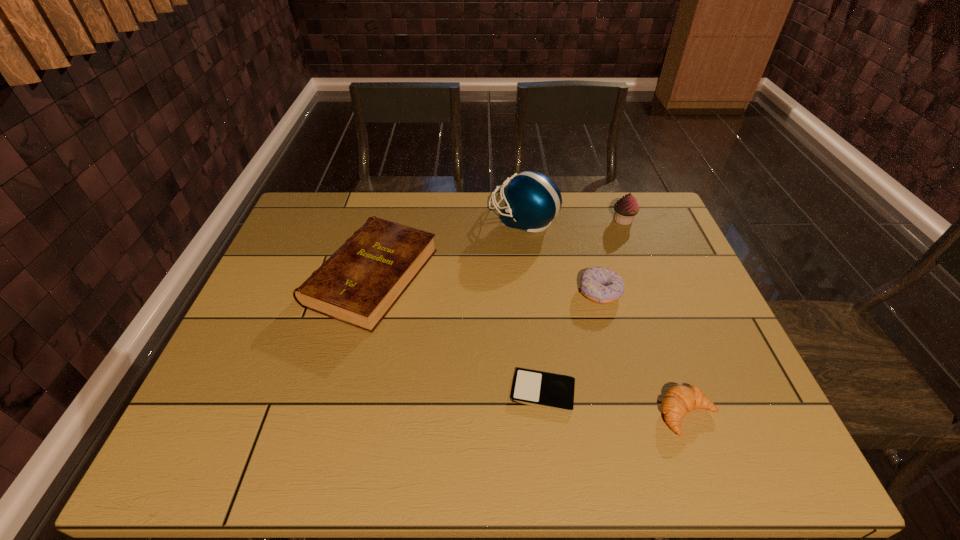
The width and height of the screenshot is (960, 540). I want to click on football helmet, so click(x=532, y=200).

I want to click on cupcake, so click(x=626, y=208).

This screenshot has height=540, width=960. I want to click on the leftmost object, so click(x=359, y=284).

I want to click on hardback book, so click(x=359, y=284).

Image resolution: width=960 pixels, height=540 pixels. Find the location of `doughnut`. doughnut is located at coordinates (602, 285).

At what (x,y) coordinates should I click in order to perform the action: click on crescent roll. Please return your answer as a coordinate pair (x, y). Looking at the image, I should click on (680, 399).

This screenshot has width=960, height=540. In order to click on iPod in this screenshot , I will do `click(547, 390)`.

You are a GUI agent. You are given a task and a screenshot of the screen. Output one action in this format:
    pyautogui.click(x=<x>, y=<y>)
    Task: Click on the vacant area situated at the front of the football helmet with the faceguard
    This screenshot has width=960, height=540.
    Given the screenshot: What is the action you would take?
    pyautogui.click(x=383, y=219)

You are a GUI agent. You are given a task and a screenshot of the screen. Output one action in this format:
    pyautogui.click(x=<x>, y=<y>)
    Task: Click on the free location located 0.230m at the front of the football helmet with the faceguard
    Image resolution: width=960 pixels, height=540 pixels.
    Given the screenshot: What is the action you would take?
    pyautogui.click(x=418, y=219)

Identify the location of free spot located 0.110m at the front of the football helmet with the faceguard. [455, 219].